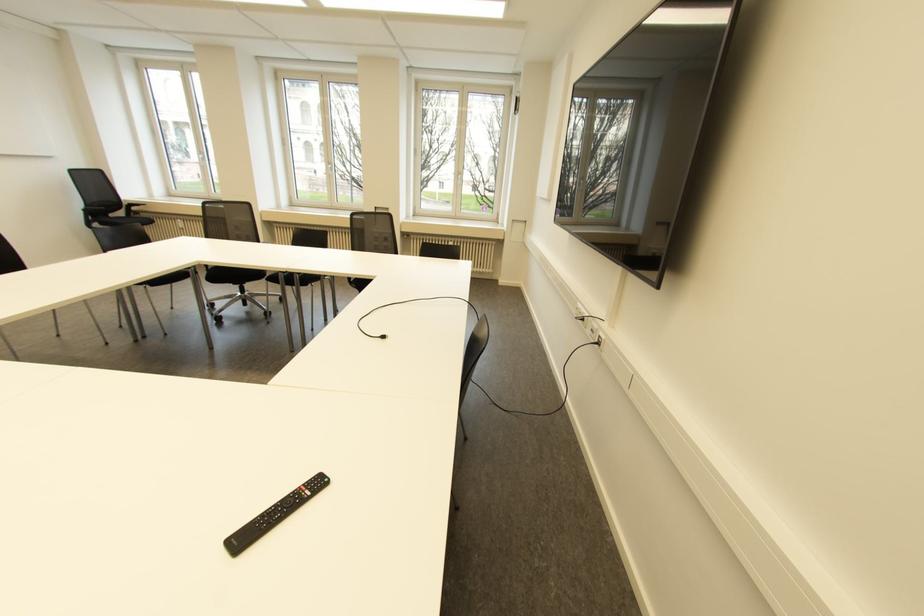
You are a GUI agent. You are given a task and a screenshot of the screen. Output one action in this format:
    pyautogui.click(x=<x>, y=<y>)
    Task: Click on the black chair armrest
    This screenshot has height=616, width=924.
    Given the screenshot: What is the action you would take?
    pyautogui.click(x=91, y=214)